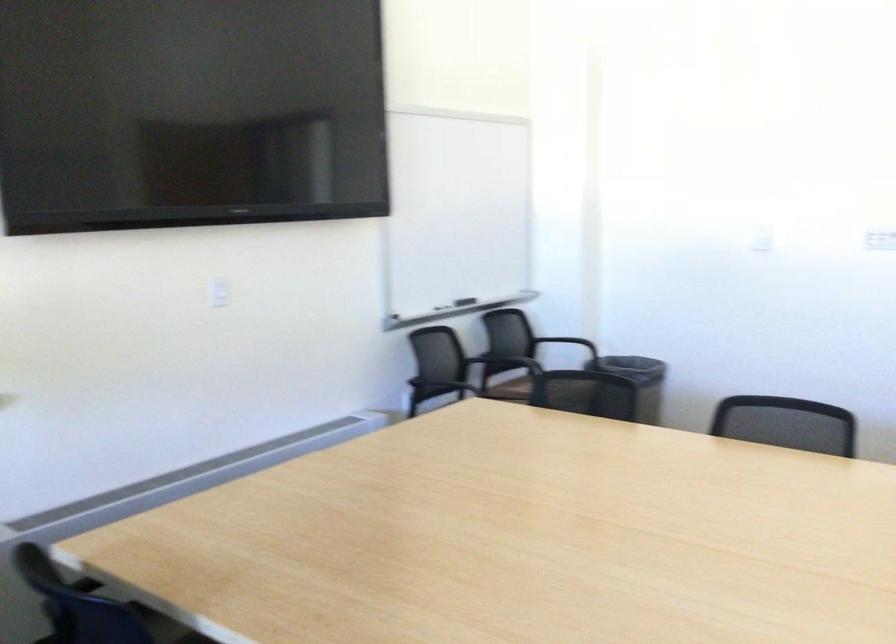
Identify the location of black chair armrest. The image size is (896, 644). (83, 585).